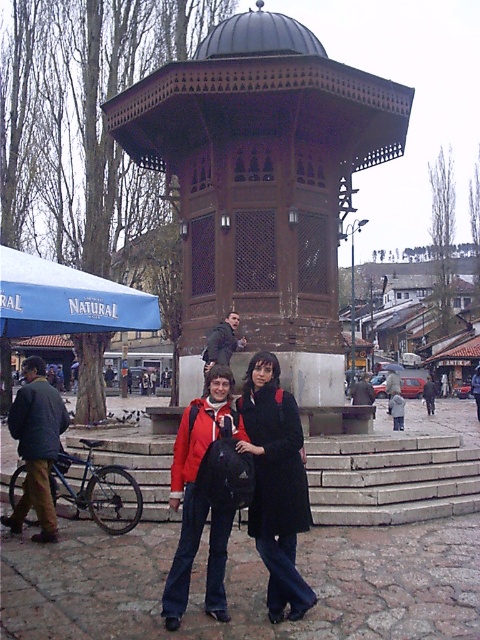
Question: Can you confirm if brown wooden gazebo at center is positioned above matte red jacket at center?

Choices:
 (A) yes
 (B) no

Answer: (A)

Question: Is matte red jacket at center to the left of blue fabric canopy at upper left from the viewer's perspective?

Choices:
 (A) yes
 (B) no

Answer: (B)

Question: Among these objects, which one is nearest to the camera?

Choices:
 (A) dark blue jacket at left
 (B) dark brown wooden bench at center

Answer: (A)

Question: Which of the following is the farthest from the observer?

Choices:
 (A) (43, 436)
 (B) (16, 316)
 (C) (195, 528)

Answer: (A)

Question: Which point is closer to the camera?

Choices:
 (A) red jacket at center
 (B) dark brown wooden bench at center
 (C) dark blue jacket at left
 (D) brown wooden gazebo at center

Answer: (A)

Question: Is brown wooden gazebo at center to the right of dark blue jacket at left from the viewer's perspective?

Choices:
 (A) yes
 (B) no

Answer: (A)